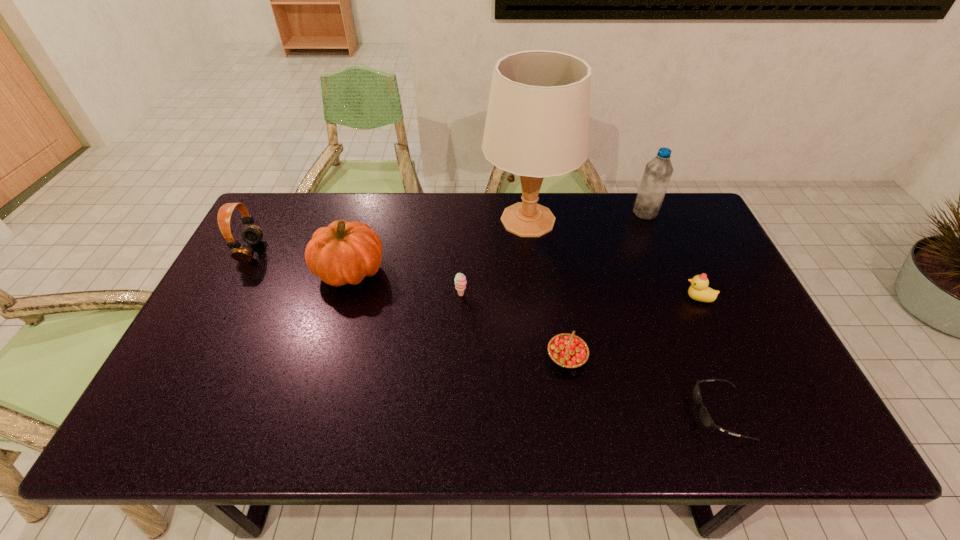
Locate an element on the screen. The image size is (960, 540). vacant region at the far edge of the desktop is located at coordinates (562, 202).

I want to click on blank area at the near edge, so click(x=666, y=428).

In the image, there is a desktop. Identify the location of free space at the left edge. This screenshot has height=540, width=960. (168, 400).

The width and height of the screenshot is (960, 540). I want to click on free location at the right edge of the desktop, so click(x=683, y=276).

This screenshot has height=540, width=960. Identify the location of free space at the far left corner of the desktop. (275, 195).

Locate an element on the screen. The width and height of the screenshot is (960, 540). vacant space at the near right corner of the desktop is located at coordinates (760, 431).

I want to click on vacant area that lies between the sunglasses and the headset, so coord(486,332).

Where is `free point between the sunglasses and the table lamp`? free point between the sunglasses and the table lamp is located at coordinates (624, 316).

Locate an element on the screen. The width and height of the screenshot is (960, 540). empty location between the pumpkin and the sunglasses is located at coordinates (536, 342).

Find the location of a particular element. vacant area between the leftmost object and the sunglasses is located at coordinates (486, 332).